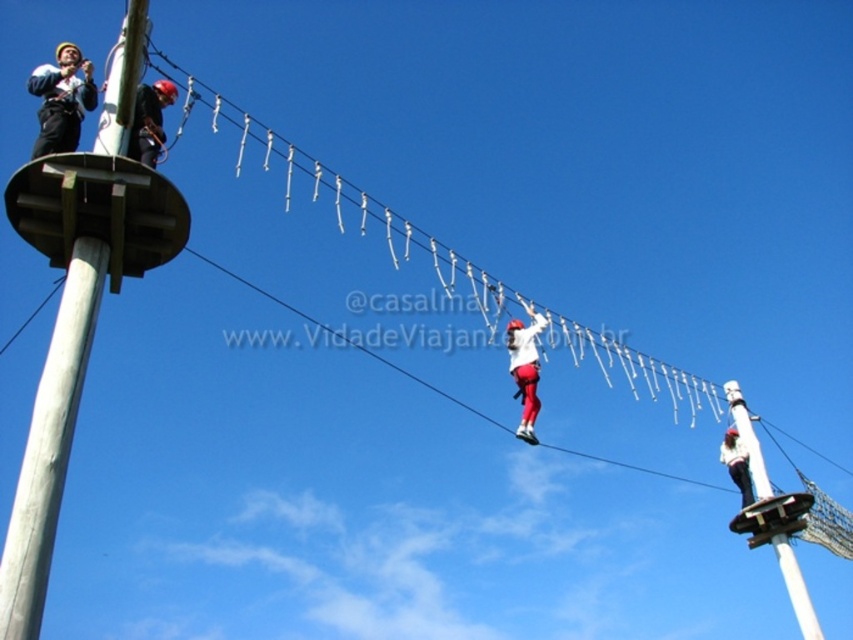
Question: Considering the relative positions of white painted wood pole at right and white matte helmet at upper center in the image provided, where is white painted wood pole at right located with respect to white matte helmet at upper center?

Choices:
 (A) above
 (B) below

Answer: (B)

Question: Is white wood pole at upper left wider than white matte helmet at center?

Choices:
 (A) yes
 (B) no

Answer: (A)

Question: Is white wood pole at upper left thinner than white matte helmet at center?

Choices:
 (A) no
 (B) yes

Answer: (A)

Question: Estimate the real-world distances between objects in this image. Which object is closer to the white matte helmet at center?

Choices:
 (A) white matte helmet at upper center
 (B) matte black helmet at upper left
 (C) white wood pole at upper left

Answer: (A)

Question: Which object is closer to the camera taking this photo?

Choices:
 (A) matte black helmet at upper center
 (B) white painted wood pole at right
 (C) white matte helmet at upper center

Answer: (A)

Question: Which point is farther to the camera?

Choices:
 (A) [x=149, y=140]
 (B) [x=807, y=628]
 (C) [x=535, y=353]

Answer: (B)